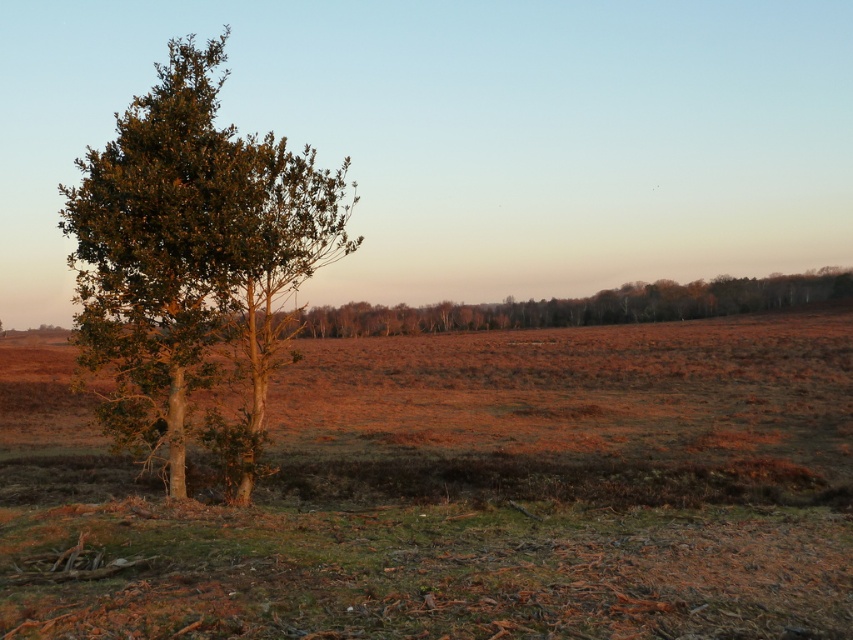
Question: Does brown grass at left have a larger size compared to green leafy tree at left?

Choices:
 (A) yes
 (B) no

Answer: (B)

Question: In this image, where is brown grass at left located relative to green leafy tree at left?

Choices:
 (A) right
 (B) left

Answer: (A)

Question: Which point is farther to the camera?

Choices:
 (A) (91, 246)
 (B) (566, 364)

Answer: (B)

Question: Which point appears closest to the camera in this image?

Choices:
 (A) (3, 374)
 (B) (86, 353)

Answer: (B)

Question: Does brown grass at left appear over green leafy tree at left?

Choices:
 (A) no
 (B) yes

Answer: (A)

Question: Which of the following is the farthest from the observer?

Choices:
 (A) (175, 140)
 (B) (387, 387)

Answer: (B)